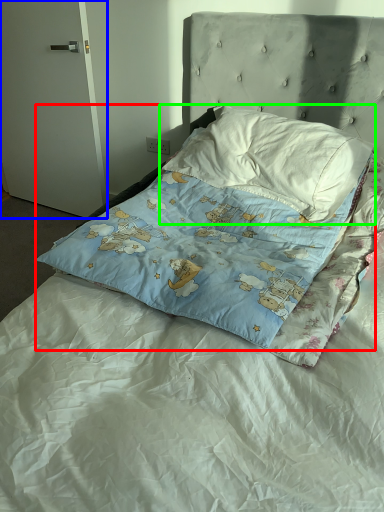
Question: Which is farther away from pillow (highlighted by a red box)? door (highlighted by a blue box) or pillow (highlighted by a green box)?

Choices:
 (A) door
 (B) pillow

Answer: (A)